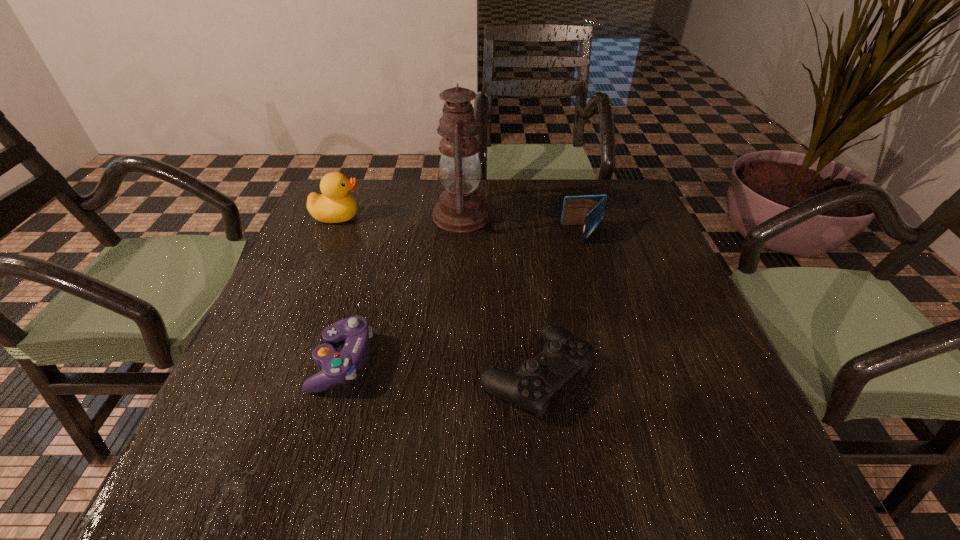
I want to click on the tallest object, so click(x=461, y=208).

You are a GUI agent. You are given a task and a screenshot of the screen. Output one action in this format:
    pyautogui.click(x=<x>, y=<y>)
    Task: Click on the duck
    The width and height of the screenshot is (960, 540).
    Given the screenshot: What is the action you would take?
    pyautogui.click(x=334, y=205)

Where is `the fourth shortest object`? the fourth shortest object is located at coordinates (334, 205).

This screenshot has height=540, width=960. I want to click on wallet, so click(x=587, y=210).

Find the location of a particular element. the third tallest object is located at coordinates (587, 210).

Where is `the right control`? The height and width of the screenshot is (540, 960). the right control is located at coordinates (563, 356).

At what (x,y) coordinates should I click in order to perform the action: click on the left control. Please return your answer as a coordinate pair (x, y). This screenshot has width=960, height=540. Looking at the image, I should click on (337, 367).

Locate an element on the screen. The image size is (960, 540). free space located 0.370m on the right of the tallest object is located at coordinates (626, 216).

At what (x,y) coordinates should I click in order to perform the action: click on free location located 0.350m at the beak of the duck. Please return your answer as a coordinate pair (x, y). The image size is (960, 540). Looking at the image, I should click on (491, 216).

You are a GUI agent. You are given a task and a screenshot of the screen. Output one action in this format:
    pyautogui.click(x=<x>, y=<y>)
    Task: Click on the vacant space located on the exterior surface of the third tallest object
    The width and height of the screenshot is (960, 540).
    Given the screenshot: What is the action you would take?
    (x=427, y=234)